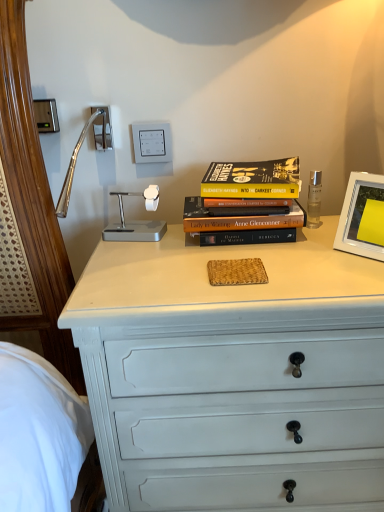
Locate an element on the screen. vacant space in front of hardcover book at center is located at coordinates (263, 266).